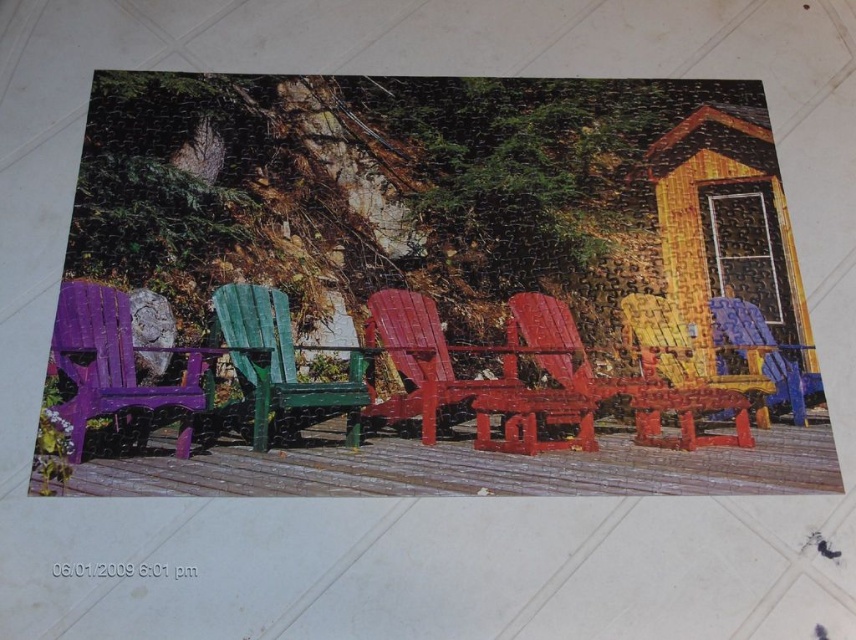
Between matte purple wood chair at left and blue glossy chair at center, which one is positioned lower?

Positioned lower is matte purple wood chair at left.

Find the location of a particular element. matte purple wood chair at left is located at coordinates (116, 364).

I want to click on matte purple wood chair at left, so click(116, 364).

Can you confirm if purple matte plastic chair at left is wider than glossy wood chair at center?

Yes, purple matte plastic chair at left is wider than glossy wood chair at center.

Does point (319, 136) come closer to viewer compared to point (403, 291)?

No, (319, 136) is further to viewer.

Does point (159, 266) lie in front of point (411, 364)?

Yes, point (159, 266) is closer to viewer.

This screenshot has height=640, width=856. I want to click on purple matte plastic chair at left, so coord(440,196).

Looking at this image, is matte purple wood chair at left further to camera compared to wooden chair at center?

No, it is in front of wooden chair at center.

Is matte purple wood chair at left taller than wooden chair at center?

Yes, matte purple wood chair at left is taller than wooden chair at center.

Locate an element on the screen. This screenshot has height=640, width=856. matte purple wood chair at left is located at coordinates (116, 364).